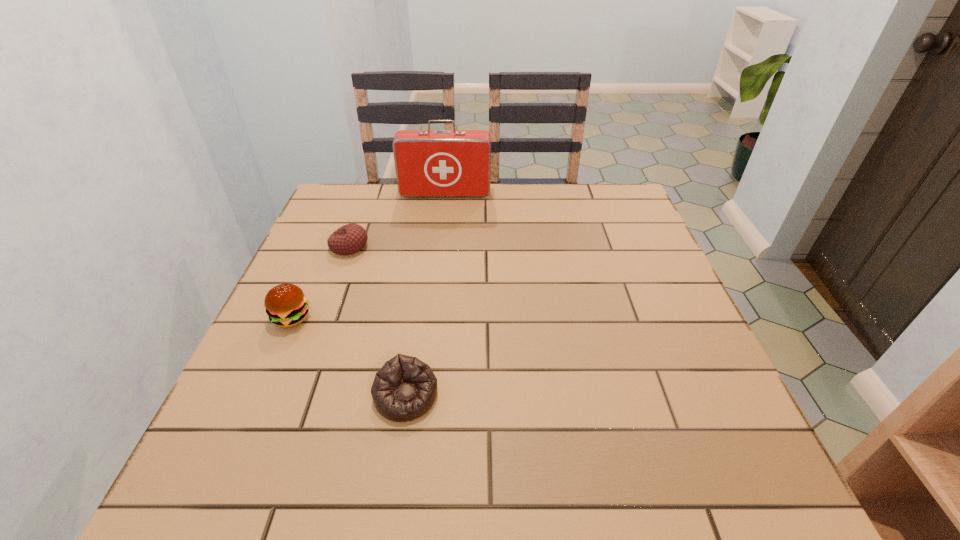
The image size is (960, 540). I want to click on vacant space situated 0.050m on the right of the third nearest object, so click(x=388, y=246).

Locate an element on the screen. The image size is (960, 540). free space located 0.350m on the right of the nearer beanbag is located at coordinates (625, 395).

What are the coordinates of `object that is at the far edge` in the screenshot? It's located at (429, 163).

You are a GUI agent. You are given a task and a screenshot of the screen. Output one action in this format:
    pyautogui.click(x=<x>, y=<y>)
    Task: Click on the hamburger situated at the left edge
    
    Given the screenshot: What is the action you would take?
    pyautogui.click(x=286, y=305)

You are a GUI agent. You are given a task and a screenshot of the screen. Output one action in this format:
    pyautogui.click(x=<x>, y=<y>)
    Task: Click on the beanbag that is positioned at the left edge
    
    Given the screenshot: What is the action you would take?
    pyautogui.click(x=350, y=238)

I want to click on vacant space at the far edge of the desktop, so click(x=517, y=219).

In the image, there is a desktop. At what (x,y) coordinates should I click in order to perform the action: click on free space at the near edge. Please return your answer as a coordinate pair (x, y). Image resolution: width=960 pixels, height=540 pixels. Looking at the image, I should click on (335, 508).

Where is `vacant area at the left edge of the desktop`? The height and width of the screenshot is (540, 960). vacant area at the left edge of the desktop is located at coordinates (316, 272).

Identify the location of vacant area at the right edge of the desktop. The width and height of the screenshot is (960, 540). (607, 285).

This screenshot has height=540, width=960. In the image, there is a desktop. What are the coordinates of `vacant space at the far left corner` in the screenshot? It's located at (363, 205).